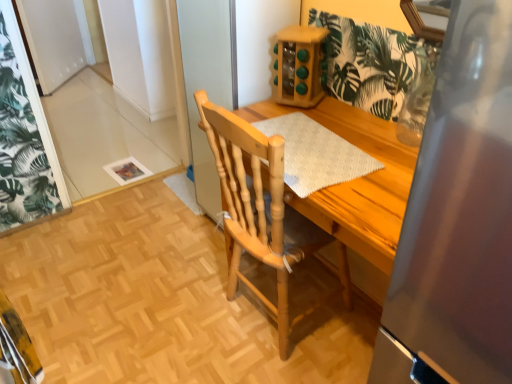
I want to click on free spot behind white textured placemat at center, so click(305, 115).